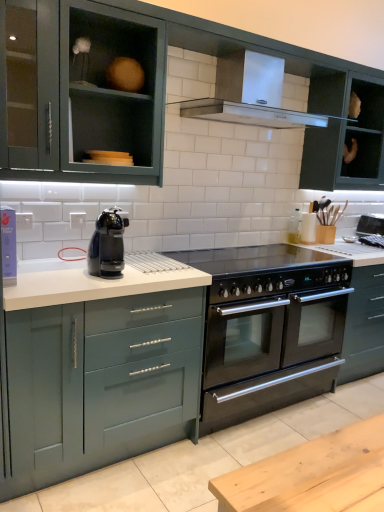
This screenshot has width=384, height=512. Describe the element at coordinates (163, 95) in the screenshot. I see `matte green cabinets at upper center, the second cabinetry when ordered from bottom to top` at that location.

The width and height of the screenshot is (384, 512). Describe the element at coordinates (271, 339) in the screenshot. I see `black stainless steel oven at center` at that location.

Locate an element on the screen. The image size is (384, 512). matte black cabinet at upper right, the 4th cabinetry when ordered from bottom to top is located at coordinates (345, 134).

Image resolution: width=384 pixels, height=512 pixels. Find the location of `matte green cabinets at upper center, the second cabinetry when ordered from bottom to top`. matte green cabinets at upper center, the second cabinetry when ordered from bottom to top is located at coordinates (163, 95).

In the scene shown: Considering the positions of objects black stainless steel oven at center and black plastic coffee machine at center in the image provided, who is behind, black stainless steel oven at center or black plastic coffee machine at center?

Positioned behind is black stainless steel oven at center.

Identify the location of oven behind the black plastic coffee machine at center. (271, 339).

How far apart are black stainless steel oven at center and black plastic coffee machine at center?

38.75 inches.

Which object is thinner, black stainless steel oven at center or black plastic coffee machine at center?

black plastic coffee machine at center is thinner.

Can you confirm if black glass cooktop at center is shorter than black stainless steel oven at center?

Indeed, black glass cooktop at center has a lesser height compared to black stainless steel oven at center.

Considering the relative positions of black glass cooktop at center and black stainless steel oven at center in the image provided, is black glass cooktop at center in front of black stainless steel oven at center?

Yes, black glass cooktop at center is closer to the camera.

The width and height of the screenshot is (384, 512). In order to click on appliance behind the black glass cooktop at center in this screenshot , I will do `click(370, 224)`.

Does black glass cooktop at center touch black stainless steel oven at center?

No, black glass cooktop at center is not next to black stainless steel oven at center.

Which of these two, matte black cabinet at upper right, the first cabinetry in the top-to-bottom sequence, or black stainless steel oven at center, is wider?

black stainless steel oven at center.

Which object is positioned more to the left, matte black cabinet at upper right, the 4th cabinetry when ordered from bottom to top, or black stainless steel oven at center?

From the viewer's perspective, black stainless steel oven at center appears more on the left side.

From a real-world perspective, which is physically above, matte black cabinet at upper right, the first cabinetry in the top-to-bottom sequence, or black stainless steel oven at center?

In real-world perspective, matte black cabinet at upper right, the first cabinetry in the top-to-bottom sequence, is above.

Are matte green cabinet at upper left, the second cabinetry in the top-to-bottom sequence, and black plastic coffee machine at center far apart?

They are positioned close to each other.

Is matte green cabinet at upper left, positioned as the third cabinetry in bottom-to-top order, completely or partially outside of black plastic coffee machine at center?

matte green cabinet at upper left, positioned as the third cabinetry in bottom-to-top order, lies outside black plastic coffee machine at center's area.

Considering the positions of objects matte green cabinet at upper left, the second cabinetry in the top-to-bottom sequence, and black plastic coffee machine at center in the image provided, who is more to the left, matte green cabinet at upper left, the second cabinetry in the top-to-bottom sequence, or black plastic coffee machine at center?

From the viewer's perspective, matte green cabinet at upper left, the second cabinetry in the top-to-bottom sequence, appears more on the left side.

From a real-world perspective, between matte green cabinet at upper left, the second cabinetry in the top-to-bottom sequence, and black plastic coffee machine at center, who is vertically lower?

From a 3D spatial view, black plastic coffee machine at center is below.

From the image's perspective, between black glass cooktop at center and satin silver range hood at upper center, which one is located above?

satin silver range hood at upper center.

Considering the positions of objects black glass cooktop at center and satin silver range hood at upper center in the image provided, who is in front, black glass cooktop at center or satin silver range hood at upper center?

satin silver range hood at upper center.

How much distance is there between black glass cooktop at center and satin silver range hood at upper center?

black glass cooktop at center is 36.20 inches away from satin silver range hood at upper center.

Does black glass cooktop at center have a greater height compared to satin silver range hood at upper center?

Incorrect, the height of black glass cooktop at center is not larger of that of satin silver range hood at upper center.

Is matte black cabinet at upper right, the first cabinetry in the top-to-bottom sequence, at the back of black glass cooktop at center?

No, matte black cabinet at upper right, the first cabinetry in the top-to-bottom sequence, is not at the back of black glass cooktop at center.

Considering the relative positions of black glass cooktop at center and matte black cabinet at upper right, the 4th cabinetry when ordered from bottom to top, in the image provided, is black glass cooktop at center to the left of matte black cabinet at upper right, the 4th cabinetry when ordered from bottom to top, from the viewer's perspective?

Correct, you'll find black glass cooktop at center to the left of matte black cabinet at upper right, the 4th cabinetry when ordered from bottom to top.

Considering the sizes of objects black glass cooktop at center and matte black cabinet at upper right, the first cabinetry in the top-to-bottom sequence, in the image provided, who is shorter, black glass cooktop at center or matte black cabinet at upper right, the first cabinetry in the top-to-bottom sequence,?

Standing shorter between the two is black glass cooktop at center.

Does black glass cooktop at center come behind matte black cabinet at upper right, the 4th cabinetry when ordered from bottom to top?

No, black glass cooktop at center is in front of matte black cabinet at upper right, the 4th cabinetry when ordered from bottom to top.

Considering the sizes of objects matte green cabinet at upper left, positioned as the third cabinetry in bottom-to-top order, and matte green cabinets at upper center, the second cabinetry when ordered from bottom to top, in the image provided, who is wider, matte green cabinet at upper left, positioned as the third cabinetry in bottom-to-top order, or matte green cabinets at upper center, the second cabinetry when ordered from bottom to top,?

Answer: With larger width is matte green cabinet at upper left, positioned as the third cabinetry in bottom-to-top order.

What's the angular difference between matte green cabinet at upper left, the second cabinetry in the top-to-bottom sequence, and matte green cabinets at upper center, which is counted as the third cabinetry, starting from the top,'s facing directions?

They differ by 0.602 degrees in their facing directions.

Is matte green cabinet at upper left, positioned as the third cabinetry in bottom-to-top order, taller than matte green cabinets at upper center, the second cabinetry when ordered from bottom to top?

No.

Is matte green cabinet at upper left, the second cabinetry in the top-to-bottom sequence, inside the boundaries of matte green cabinets at upper center, the second cabinetry when ordered from bottom to top, or outside?

matte green cabinet at upper left, the second cabinetry in the top-to-bottom sequence, cannot be found inside matte green cabinets at upper center, the second cabinetry when ordered from bottom to top.

Image resolution: width=384 pixels, height=512 pixels. In order to click on oven on the right of the black plastic coffee machine at center in this screenshot , I will do `click(271, 339)`.

The width and height of the screenshot is (384, 512). I want to click on gas stove in front of the black stainless steel oven at center, so click(254, 259).

From the image, which object appears to be farther from black stainless steel oven at center, satin silver range hood at upper center or matte green cabinet at upper left, positioned as the third cabinetry in bottom-to-top order?

matte green cabinet at upper left, positioned as the third cabinetry in bottom-to-top order, is positioned further to the anchor black stainless steel oven at center.

When comparing their distances from black stainless steel oven at center, does matte teal cabinet at left, the fourth cabinetry from the top, or matte black cabinet at upper right, the first cabinetry in the top-to-bottom sequence, seem further?

Among the two, matte teal cabinet at left, the fourth cabinetry from the top, is located further to black stainless steel oven at center.

When comparing their distances from matte green cabinets at upper center, which is counted as the third cabinetry, starting from the top, does black stainless steel oven at center or matte teal cabinet at left, the fourth cabinetry from the top, seem further?

Among the two, black stainless steel oven at center is located further to matte green cabinets at upper center, which is counted as the third cabinetry, starting from the top.

From the image, which object appears to be farther from satin silver range hood at upper center, black glass cooktop at center or black stainless steel oven at center?

The object further to satin silver range hood at upper center is black stainless steel oven at center.

From the image, which object appears to be nearer to matte teal cabinet at left, which appears as the first cabinetry when ordered from the bottom, satin silver range hood at upper center or black stainless steel oven at center?

satin silver range hood at upper center is closer to matte teal cabinet at left, which appears as the first cabinetry when ordered from the bottom.

From the image, which object appears to be farther from black stainless steel oven at center, white matte countertop at lower center or matte black cabinet at upper right, the first cabinetry in the top-to-bottom sequence?

Based on the image, white matte countertop at lower center appears to be further to black stainless steel oven at center.

Based on the photo, looking at the image, which one is located further to matte teal cabinet at left, the fourth cabinetry from the top, matte green cabinet at upper left, the second cabinetry in the top-to-bottom sequence, or black glass cooktop at center?

matte green cabinet at upper left, the second cabinetry in the top-to-bottom sequence, lies further to matte teal cabinet at left, the fourth cabinetry from the top, than the other object.

Based on their spatial positions, is black stainless steel oven at center or matte green cabinet at upper left, positioned as the third cabinetry in bottom-to-top order, closer to black stainless steel oven at center?

Among the two, matte green cabinet at upper left, positioned as the third cabinetry in bottom-to-top order, is located nearer to black stainless steel oven at center.

Where is `oven between black plastic coffee machine at center and black glass cooktop at center in the horizontal direction`? The image size is (384, 512). oven between black plastic coffee machine at center and black glass cooktop at center in the horizontal direction is located at coordinates (271, 339).

Where is `gas stove between satin silver range hood at upper center and white matte countertop at lower center in the vertical direction`? The height and width of the screenshot is (512, 384). gas stove between satin silver range hood at upper center and white matte countertop at lower center in the vertical direction is located at coordinates (254, 259).

Where is `gas stove between satin silver range hood at upper center and matte teal cabinet at left, which appears as the first cabinetry when ordered from the bottom, in the up-down direction`? This screenshot has width=384, height=512. gas stove between satin silver range hood at upper center and matte teal cabinet at left, which appears as the first cabinetry when ordered from the bottom, in the up-down direction is located at coordinates [x=254, y=259].

Find the location of a particular element. home appliance between satin silver range hood at upper center and white matte countertop at lower center in the vertical direction is located at coordinates (108, 244).